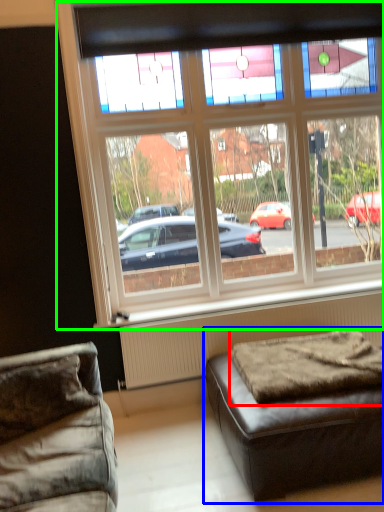
Question: Estimate the real-world distances between objects in this image. Which object is farther from mattress (highlighted by a red box), studio couch (highlighted by a blue box) or window (highlighted by a green box)?

Choices:
 (A) studio couch
 (B) window

Answer: (B)